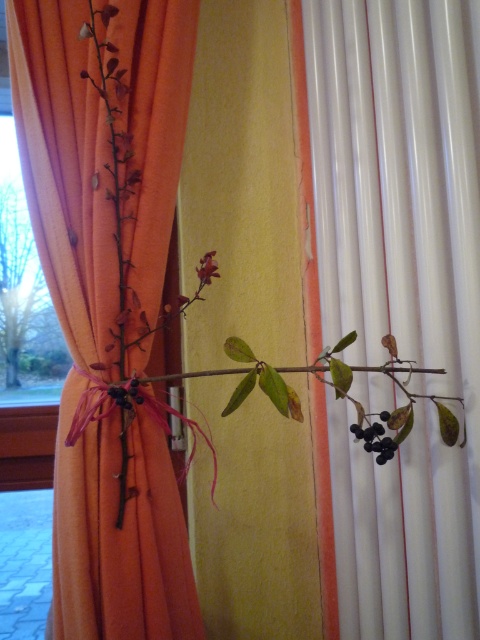
Between green matte branch at right and black matte berries at center, which one has more height?

green matte branch at right

Does point (465, 348) come farther from viewer compared to point (388, 417)?

No.

In order to click on green matte branch at right in this screenshot , I will do `click(400, 296)`.

Is orange fabric curtain at left positioned behind matte red flower at center?

No.

Can you confirm if orange fabric curtain at left is smaller than matte red flower at center?

No, orange fabric curtain at left is not smaller than matte red flower at center.

Between point (124, 80) and point (208, 256), which one is positioned in front?

Positioned in front is point (124, 80).

At what (x,y) coordinates should I click in order to perform the action: click on orange fabric curtain at left. Please return your answer as a coordinate pair (x, y). The image size is (480, 640). Looking at the image, I should click on (108, 296).

This screenshot has height=640, width=480. Identify the location of orange fabric curtain at left. (108, 296).

Does orange fabric curtain at left have a greater width compared to green matte branch at center?

Incorrect, orange fabric curtain at left's width does not surpass green matte branch at center's.

Which is in front, point (76, 196) or point (139, 378)?

Point (139, 378)

Image resolution: width=480 pixels, height=640 pixels. In order to click on orange fabric curtain at left in this screenshot , I will do `click(108, 296)`.